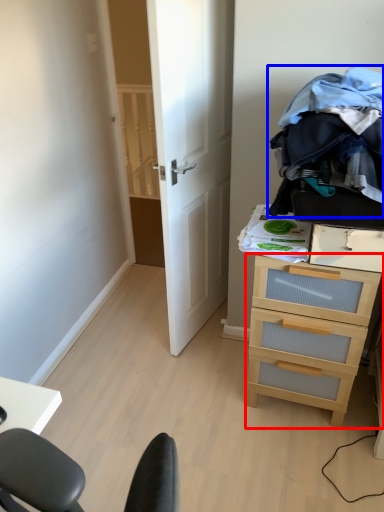
Question: Which object is further to the camera taking this photo, chest of drawers (highlighted by a red box) or clothing (highlighted by a blue box)?

Choices:
 (A) chest of drawers
 (B) clothing

Answer: (A)